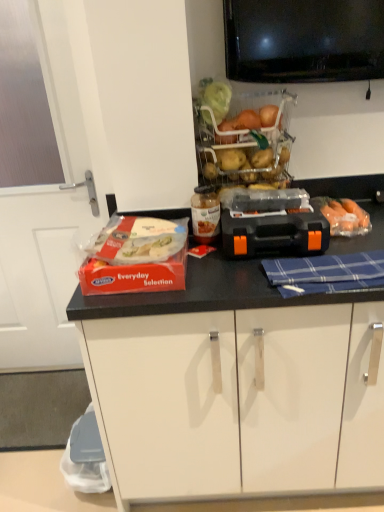
Locate an element on the screen. The image size is (384, 512). translucent plastic basket at upper center is located at coordinates (245, 139).

What do you see at coordinates (345, 217) in the screenshot? The height and width of the screenshot is (512, 384). I see `translucent plastic carrots at right, the first food positioned from the right` at bounding box center [345, 217].

The width and height of the screenshot is (384, 512). I want to click on translucent plastic carrots at right, positioned as the 2th food in left-to-right order, so [345, 217].

Where is `blue plaid cloth at center`? blue plaid cloth at center is located at coordinates (326, 273).

Describe the element at coordinates (326, 273) in the screenshot. I see `blue plaid cloth at center` at that location.

You are a GUI agent. You are given a task and a screenshot of the screen. Output one action in this format:
    pyautogui.click(x=<x>, y=<y>)
    Task: Click on the black plastic toolbox at center
    
    Given the screenshot: What is the action you would take?
    pyautogui.click(x=272, y=223)

You are a GUI agent. You are given a task and a screenshot of the screen. Output one action in this format:
    pyautogui.click(x=<x>, y=<y>)
    Task: Click on the translucent plastic basket at upper center
    The width and height of the screenshot is (384, 512).
    Given the screenshot: What is the action you would take?
    pyautogui.click(x=245, y=139)

Considering the relative positions of black plastic toolbox at center and translucent plastic carrots at right, the first food positioned from the right, in the image provided, is black plastic toolbox at center to the left of translucent plastic carrots at right, the first food positioned from the right, from the viewer's perspective?

Yes.

Is black plastic toolbox at center taller than translucent plastic carrots at right, the first food positioned from the right?

Yes.

How different are the orientations of black plastic toolbox at center and translucent plastic carrots at right, positioned as the 2th food in left-to-right order, in degrees?

They differ by 0.00147 degrees in their facing directions.

From the image's perspective, which object appears higher, black plastic toolbox at center or translucent plastic carrots at right, the first food positioned from the right?

From the image's view, translucent plastic carrots at right, the first food positioned from the right, is above.

Considering the sizes of black plastic toolbox at center and white glossy door at left in the image, is black plastic toolbox at center taller or shorter than white glossy door at left?

Considering their sizes, black plastic toolbox at center has less height than white glossy door at left.

In the scene shown: Is black plastic toolbox at center oriented away from white glossy door at left?

No, black plastic toolbox at center's orientation is not away from white glossy door at left.

Who is bigger, black plastic toolbox at center or white glossy door at left?

Bigger between the two is white glossy door at left.

Which of these two, translucent plastic basket at upper center or blue plaid cloth at center, stands taller?

With more height is translucent plastic basket at upper center.

Considering the relative sizes of translucent plastic basket at upper center and blue plaid cloth at center in the image provided, is translucent plastic basket at upper center thinner than blue plaid cloth at center?

No, translucent plastic basket at upper center is not thinner than blue plaid cloth at center.

How far apart are translucent plastic basket at upper center and blue plaid cloth at center?

translucent plastic basket at upper center is 48.87 centimeters from blue plaid cloth at center.

Is translucent plastic basket at upper center aimed at blue plaid cloth at center?

Yes, translucent plastic basket at upper center is aimed at blue plaid cloth at center.

At what (x,y) coordinates should I click in order to perform the action: click on blanket lying below the translucent plastic food at center left, marked as the 1th food in a left-to-right arrangement (from the image's perspective). Please return your answer as a coordinate pair (x, y). Looking at the image, I should click on (326, 273).

Does blue plaid cloth at center have a smaller size compared to translucent plastic food at center left, which appears as the 2th food when viewed from the right?

Correct, blue plaid cloth at center occupies less space than translucent plastic food at center left, which appears as the 2th food when viewed from the right.

Considering their positions, is blue plaid cloth at center located in front of or behind translucent plastic food at center left, marked as the 1th food in a left-to-right arrangement?

blue plaid cloth at center is positioned closer to the viewer than translucent plastic food at center left, marked as the 1th food in a left-to-right arrangement.

Is blue plaid cloth at center placed right next to translucent plastic food at center left, marked as the 1th food in a left-to-right arrangement?

They are not placed beside each other.

From the picture: Can you confirm if translucent plastic carrots at right, positioned as the 2th food in left-to-right order, is smaller than translucent plastic food at center left, which appears as the 2th food when viewed from the right?

Yes.

Is translucent plastic carrots at right, the first food positioned from the right, to the left of translucent plastic food at center left, which appears as the 2th food when viewed from the right, from the viewer's perspective?

No, translucent plastic carrots at right, the first food positioned from the right, is not to the left of translucent plastic food at center left, which appears as the 2th food when viewed from the right.

Based on the photo, from a real-world perspective, who is located higher, translucent plastic carrots at right, the first food positioned from the right, or translucent plastic food at center left, which appears as the 2th food when viewed from the right?

In real-world perspective, translucent plastic food at center left, which appears as the 2th food when viewed from the right, is above.

Which is closer to the camera, (107,261) or (333,218)?

The point (107,261) is more forward.

How different are the orientations of translucent plastic food at center left, which appears as the 2th food when viewed from the right, and translucent plastic carrots at right, the first food positioned from the right, in degrees?

The angular difference between translucent plastic food at center left, which appears as the 2th food when viewed from the right, and translucent plastic carrots at right, the first food positioned from the right, is 0.432 degrees.

Is translucent plastic food at center left, which appears as the 2th food when viewed from the right, beside translucent plastic carrots at right, positioned as the 2th food in left-to-right order?

No.

From the image's perspective, is translucent plastic food at center left, which appears as the 2th food when viewed from the right, on translucent plastic carrots at right, the first food positioned from the right?

No, from the image's perspective, translucent plastic food at center left, which appears as the 2th food when viewed from the right, is not above translucent plastic carrots at right, the first food positioned from the right.

The width and height of the screenshot is (384, 512). Find the location of `blanket below the translucent plastic carrots at right, positioned as the 2th food in left-to-right order (from a real-world perspective)`. blanket below the translucent plastic carrots at right, positioned as the 2th food in left-to-right order (from a real-world perspective) is located at coordinates (326, 273).

Would you say blue plaid cloth at center is outside translucent plastic carrots at right, positioned as the 2th food in left-to-right order?

Yes, blue plaid cloth at center is outside of translucent plastic carrots at right, positioned as the 2th food in left-to-right order.

Does blue plaid cloth at center touch translucent plastic carrots at right, positioned as the 2th food in left-to-right order?

No, blue plaid cloth at center is not touching translucent plastic carrots at right, positioned as the 2th food in left-to-right order.

In the image, there is a black plastic toolbox at center. Where is `food above it (from the image's perspective)`? This screenshot has height=512, width=384. food above it (from the image's perspective) is located at coordinates (345, 217).

In order to click on appliance above the white glossy door at left (from a real-world perspective) in this screenshot , I will do `click(272, 223)`.

Considering their positions, is translucent plastic basket at upper center positioned further to white glossy door at left than translucent plastic food at center left, marked as the 1th food in a left-to-right arrangement?

The object further to white glossy door at left is translucent plastic basket at upper center.

Looking at the image, which one is located closer to black plastic toolbox at center, blue plaid cloth at center or translucent plastic carrots at right, positioned as the 2th food in left-to-right order?

blue plaid cloth at center is positioned closer to the anchor black plastic toolbox at center.

Looking at the image, which one is located further to blue plaid cloth at center, translucent plastic food at center left, marked as the 1th food in a left-to-right arrangement, or translucent plastic basket at upper center?

translucent plastic basket at upper center.

Estimate the real-world distances between objects in this image. Which object is further from translucent plastic carrots at right, the first food positioned from the right, translucent plastic basket at upper center or white glossy door at left?

white glossy door at left.

Estimate the real-world distances between objects in this image. Which object is further from blue plaid cloth at center, translucent plastic basket at upper center or translucent plastic food at center left, marked as the 1th food in a left-to-right arrangement?

translucent plastic basket at upper center is further to blue plaid cloth at center.

Considering their positions, is black plastic toolbox at center positioned closer to translucent plastic food at center left, marked as the 1th food in a left-to-right arrangement, than translucent plastic basket at upper center?

black plastic toolbox at center is positioned closer to the anchor translucent plastic food at center left, marked as the 1th food in a left-to-right arrangement.

When comparing their distances from translucent plastic food at center left, marked as the 1th food in a left-to-right arrangement, does translucent plastic carrots at right, the first food positioned from the right, or blue plaid cloth at center seem further?

translucent plastic carrots at right, the first food positioned from the right, is further to translucent plastic food at center left, marked as the 1th food in a left-to-right arrangement.

Which object lies nearer to the anchor point translucent plastic food at center left, which appears as the 2th food when viewed from the right, black plastic toolbox at center or blue plaid cloth at center?

Among the two, black plastic toolbox at center is located nearer to translucent plastic food at center left, which appears as the 2th food when viewed from the right.

Find the location of a particular element. blanket situated between translucent plastic food at center left, which appears as the 2th food when viewed from the right, and translucent plastic carrots at right, the first food positioned from the right, from left to right is located at coordinates (326, 273).

Identify the location of basket between translucent plastic food at center left, which appears as the 2th food when viewed from the right, and blue plaid cloth at center from left to right. This screenshot has width=384, height=512. (245, 139).

Locate an element on the screen. This screenshot has height=512, width=384. appliance situated between white glossy door at left and translucent plastic carrots at right, the first food positioned from the right, from left to right is located at coordinates (272, 223).

This screenshot has width=384, height=512. Identify the location of food situated between white glossy door at left and translucent plastic carrots at right, the first food positioned from the right, from left to right. (138, 240).